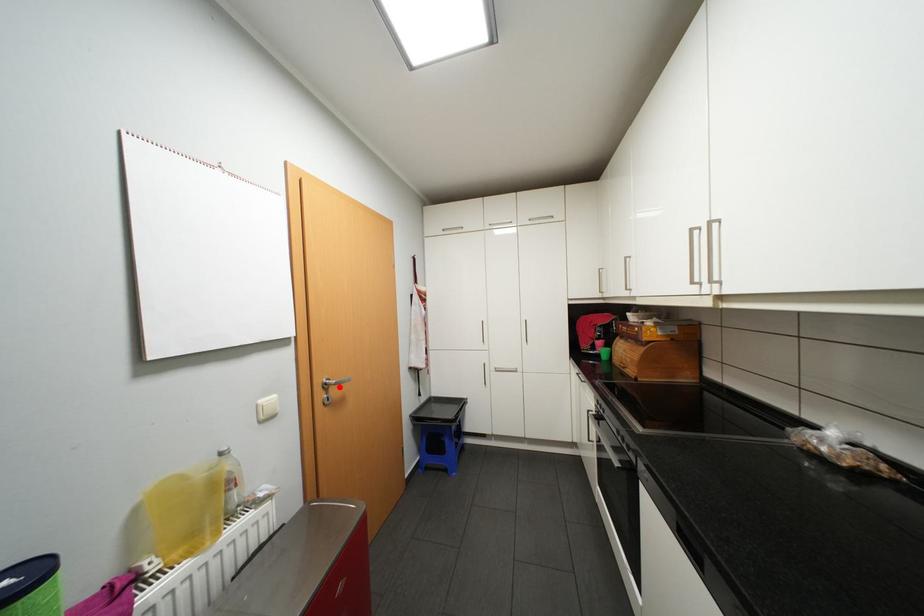
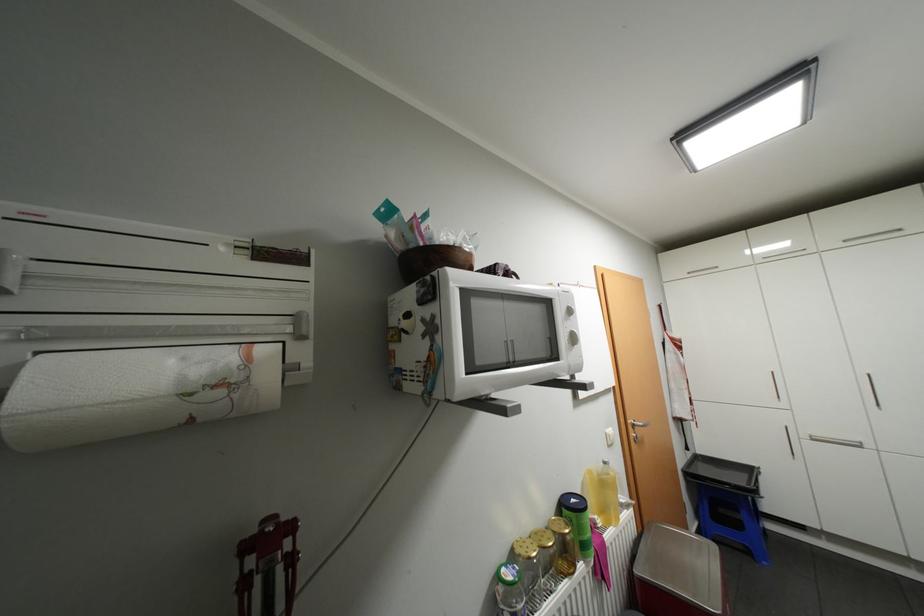
The point at the highlighted location is marked in the first image. Where is the corresponding point in the second image?

(643, 428)